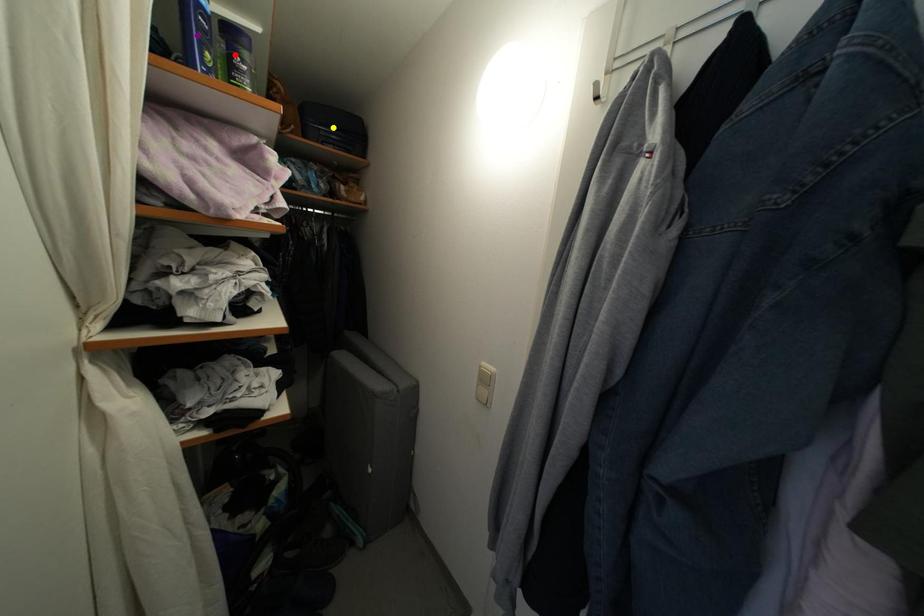
Looking at this image, order these from farthest to nearest:
- red point
- yellow point
- purple point

1. yellow point
2. red point
3. purple point